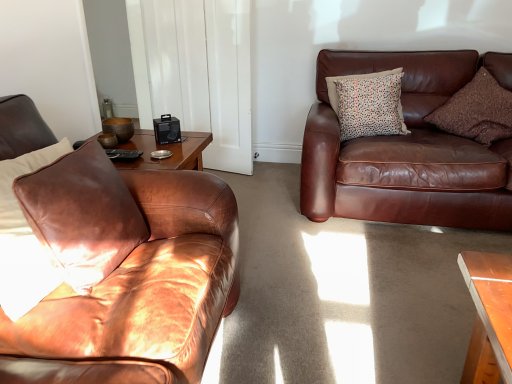
Question: Relative to brown textured pillow at upper right, the first pillow in the right-to-left sequence, is brown leather couch at right, the first studio couch from the right, in front or behind?

Choices:
 (A) front
 (B) behind

Answer: (A)

Question: Is brown leather couch at right, the second studio couch when ordered from left to right, inside or outside of brown textured pillow at upper right, which ranks as the second pillow in back-to-front order?

Choices:
 (A) inside
 (B) outside

Answer: (B)

Question: Which object is positioned closest to the brown leather pillow at left, marked as the third pillow in a right-to-left arrangement?

Choices:
 (A) matte brown leather couch at left, positioned as the 1th studio couch in left-to-right order
 (B) white glossy door at upper center
 (C) brown textured pillow at upper right, the first pillow in the right-to-left sequence
 (D) multicolored dotted cushion at upper right, the second pillow from the left
 (E) brown leather couch at right, the second studio couch viewed from the front

Answer: (A)

Question: Estimate the real-world distances between objects in this image. Which object is farther from the multicolored dotted cushion at upper right, positioned as the first pillow in back-to-front order?

Choices:
 (A) brown textured pillow at upper right, the first pillow in the right-to-left sequence
 (B) matte brown leather couch at left, the 2th studio couch in the right-to-left sequence
 (C) brown leather pillow at left, marked as the third pillow in a right-to-left arrangement
 (D) brown leather couch at right, the second studio couch when ordered from left to right
 (E) white glossy door at upper center

Answer: (C)